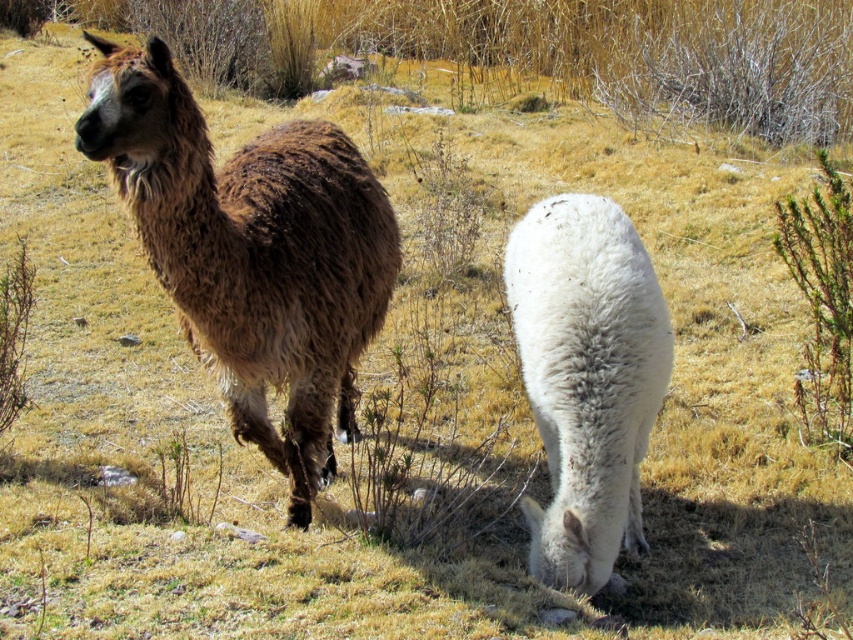
You are standing at the origin point of the coordinate system. You want to walk to the brown woolly alpaca at left. What direction should you move in?

Since the brown woolly alpaca at left is located at coordinate point 0.394 on the x axis and 0.295 on the y axis, you should move northeast to reach it.

You are standing at point A, which is at coordinates point (263, 369), and you want to walk to point B at coordinates point (616, 508). Which direction should you move to reach point B from point A?

To move from point A at coordinates point (263, 369) to point B at coordinates point (616, 508), you should move forward because point A is behind point B.

You are a farmer who needs to separate the two animals using a fence. The fence can only be placed between them. Given that the minimum distance required for the fence to be effective is 40 inches, will the fence work between the brown woolly alpaca at left and the white woolen llama at center?

The distance between the brown woolly alpaca at left and the white woolen llama at center is 38.36 inches, which is less than the required 40 inches. Therefore, the fence will not be effective.